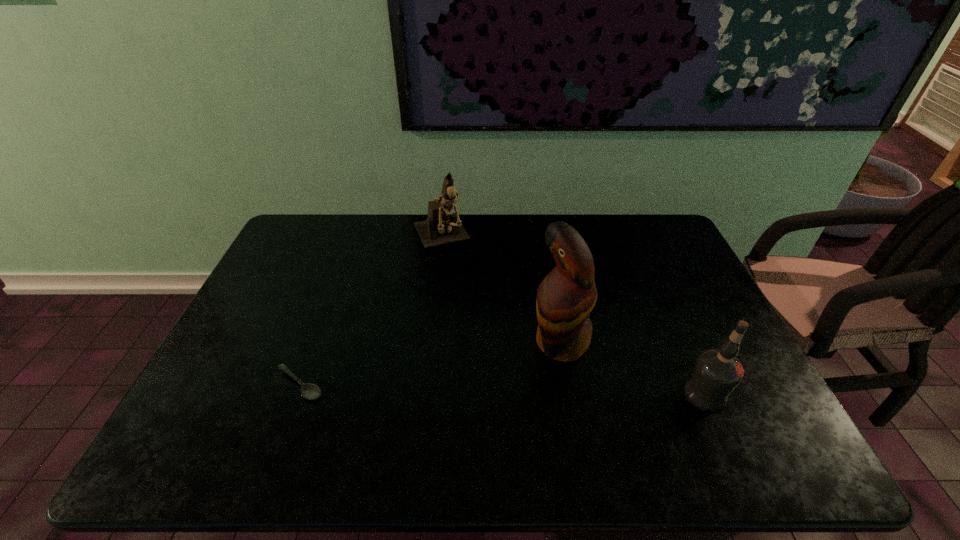
This screenshot has height=540, width=960. Identify the location of soupspoon. (309, 391).

Locate an element on the screen. the leftmost object is located at coordinates (309, 391).

The width and height of the screenshot is (960, 540). In order to click on the third tallest object in this screenshot , I will do `click(717, 372)`.

Image resolution: width=960 pixels, height=540 pixels. Find the location of `vodka`. vodka is located at coordinates (717, 372).

Where is `parrot`? The width and height of the screenshot is (960, 540). parrot is located at coordinates (565, 298).

This screenshot has width=960, height=540. Identify the location of the second farthest object. (565, 298).

At what (x,y) coordinates should I click in order to perform the action: click on the second tallest object. Please return your answer as a coordinate pair (x, y). This screenshot has height=540, width=960. Looking at the image, I should click on (442, 226).

This screenshot has height=540, width=960. In order to click on the second object from left to right in this screenshot , I will do `click(442, 226)`.

Where is `vacant region located 0.140m on the back of the shortest object`? The image size is (960, 540). vacant region located 0.140m on the back of the shortest object is located at coordinates (321, 328).

Where is `vacant area situated 0.180m on the face of the second object from right to left`? The height and width of the screenshot is (540, 960). vacant area situated 0.180m on the face of the second object from right to left is located at coordinates (479, 386).